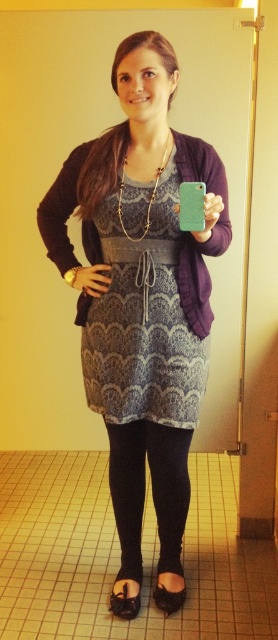
Question: Is black suede sandal at lower center below black fabric sandal at lower center?

Choices:
 (A) no
 (B) yes

Answer: (B)

Question: In this image, where is matte black dress at center located relative to black knit leggings at lower center?

Choices:
 (A) left
 (B) right

Answer: (A)

Question: Can you confirm if purple knit cardigan at center is smaller than black suede sandal at lower center?

Choices:
 (A) yes
 (B) no

Answer: (B)

Question: Which of the following is the closest to the observer?

Choices:
 (A) purple knit cardigan at center
 (B) black fabric sandal at lower center

Answer: (A)

Question: Estimate the real-world distances between objects in this image. Which object is farther from the purple knit cardigan at center?

Choices:
 (A) matte black dress at center
 (B) black suede sandal at lower center
 (C) blue textured dress at center
 (D) black fabric sandal at lower center

Answer: (D)

Question: Based on their relative distances, which object is nearer to the black knit leggings at lower center?

Choices:
 (A) black suede sandal at lower center
 (B) purple knit cardigan at center

Answer: (A)